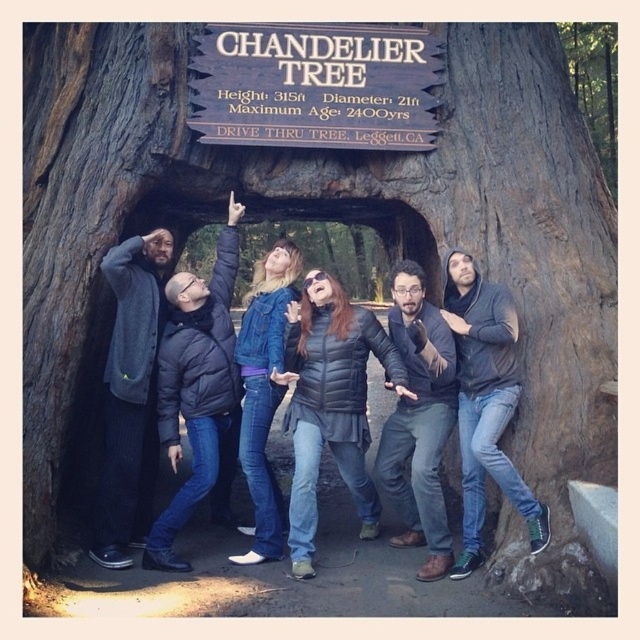
Question: Does black puffer jacket at upper left come behind dark gray puffer jacket at center?

Choices:
 (A) no
 (B) yes

Answer: (B)

Question: Which point appears farthest from the camera in this image?

Choices:
 (A) (244, 401)
 (B) (224, 33)
 (C) (220, 252)

Answer: (C)

Question: Which of these objects is positioned farthest from the dark gray hoodie at center?

Choices:
 (A) black puffer jacket at upper left
 (B) denim jacket at center
 (C) dark gray puffer jacket at center

Answer: (A)

Question: Observing the image, what is the correct spatial positioning of dark gray sweater at left in reference to dark gray puffer jacket at center?

Choices:
 (A) left
 (B) right

Answer: (A)

Question: Where is black puffer jacket at upper left located in relation to dark gray hoodie at center in the image?

Choices:
 (A) below
 (B) above

Answer: (B)

Question: Which point appears closest to the camera in this image?

Choices:
 (A) coord(268,397)
 (B) coord(326,328)
 (C) coord(436,324)
 (D) coord(195,401)

Answer: (C)